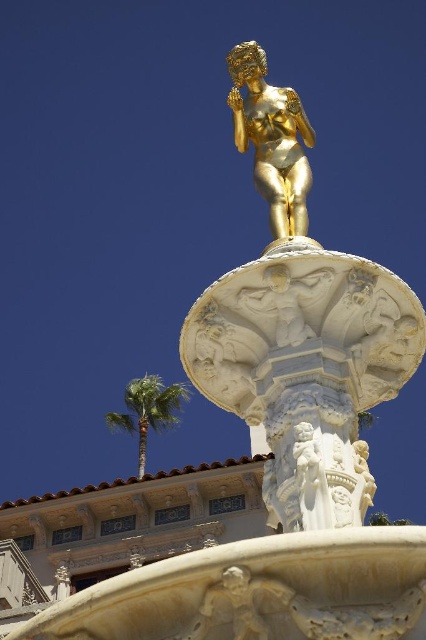
You are standing in front of the fountain and want to take a photo of the gold metallic statue at center. Where should you position yourself relative to the fountain to ensure the statue is centered in your photo?

To center the gold metallic statue at center in your photo, position yourself directly in front of the point at coordinates 0.217 on the x axis and 0.638 on the y axis relative to the fountain structure.

You are standing in front of the fountain and want to take a photo of the gold polished statue at center so that the green leafy palm tree at lower left is visible in the background. Which side should you position yourself to capture both in the frame?

You should position yourself to the right of the gold polished statue at center so that the green leafy palm tree at lower left is visible to its left side in the background.

You are an art conservator examining the fountain structure. You notice two gold statues at the center. Which one is closer to you, the gold polished statue at center or the gold metallic statue at center?

The gold polished statue at center is closer to you because it is positioned in front of the gold metallic statue at center.